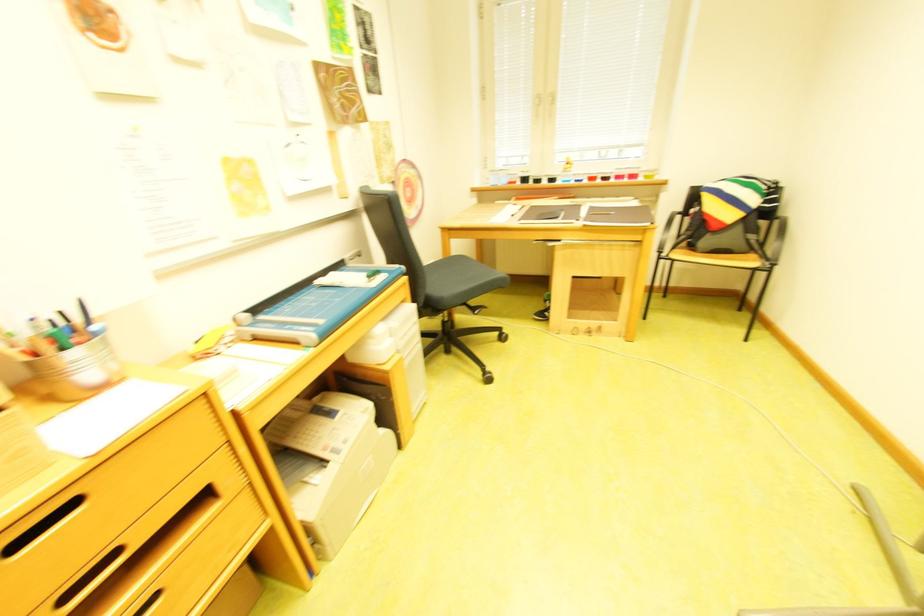
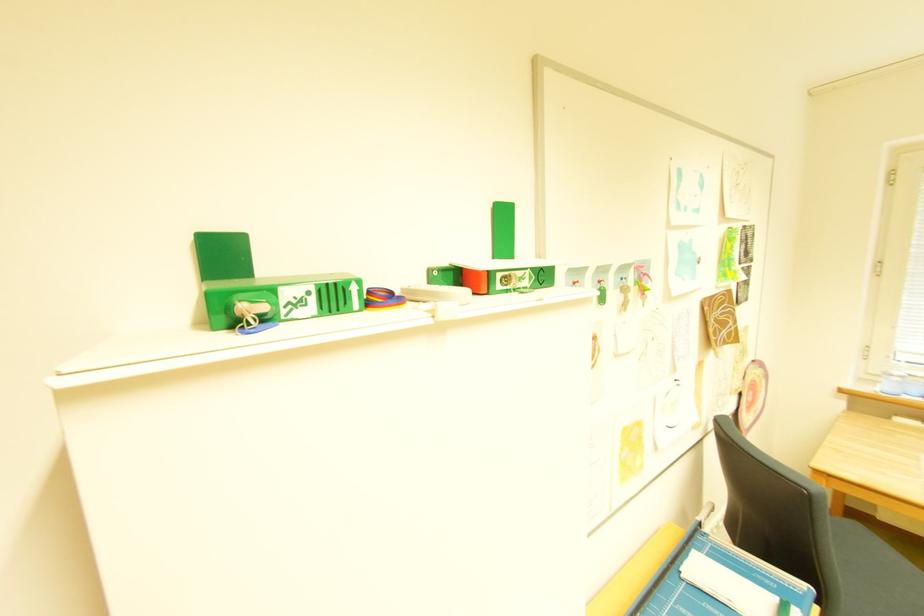
Question: How did the camera likely rotate?

Choices:
 (A) Left
 (B) Right
 (C) Up
 (D) Down

Answer: (A)